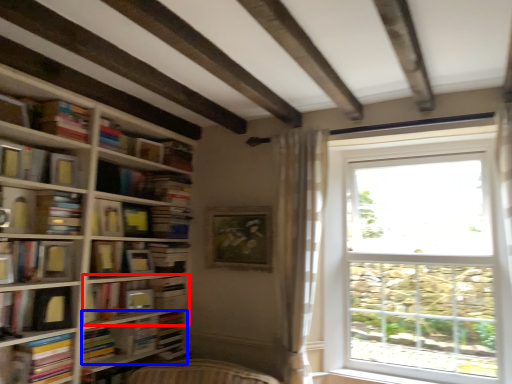
Question: Which object is closer to the camera taking this photo, shelf (highlighted by a red box) or book (highlighted by a blue box)?

Choices:
 (A) shelf
 (B) book

Answer: (B)